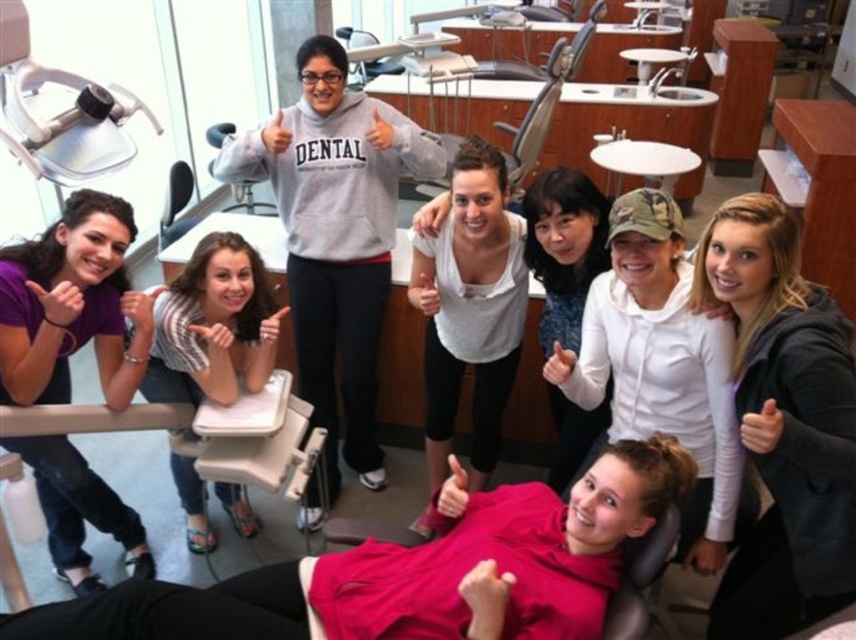
Which is behind, point (813, 536) or point (452, 177)?

The point (452, 177) is behind.

Locate an element on the screen. This screenshot has width=856, height=640. dark brown hair at center is located at coordinates (783, 422).

What do you see at coordinates (137, 308) in the screenshot? I see `matte plastic ring at lower left` at bounding box center [137, 308].

Locate an element on the screen. matte plastic ring at lower left is located at coordinates (137, 308).

Who is lower down, gray sweatshirt at center or matte plastic ring at lower left?

matte plastic ring at lower left is lower down.

Between point (298, 161) and point (143, 292), which one is positioned behind?

Positioned behind is point (298, 161).

The image size is (856, 640). What do you see at coordinates (336, 237) in the screenshot? I see `gray sweatshirt at center` at bounding box center [336, 237].

The height and width of the screenshot is (640, 856). I want to click on gray sweatshirt at center, so click(x=336, y=237).